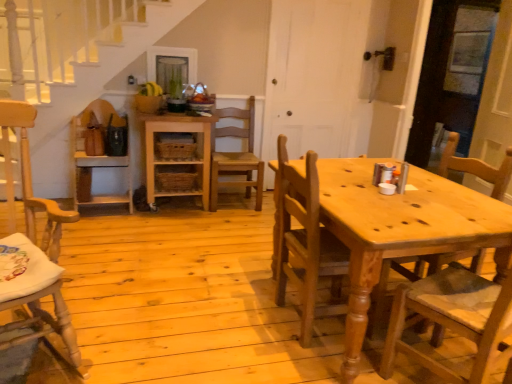
The image size is (512, 384). Identify the location of free space in front of wooden chair at center, which is counted as the 5th chair, starting from the right. (98, 227).